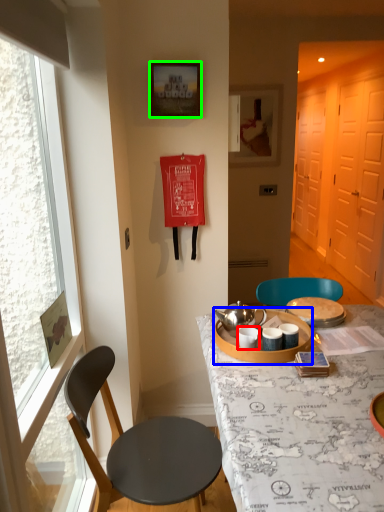
Question: Estimate the real-world distances between objects in this image. Which object is closer to coffee cup (highlighted by a red box), tableware (highlighted by a blue box) or picture frame (highlighted by a green box)?

Choices:
 (A) tableware
 (B) picture frame

Answer: (A)